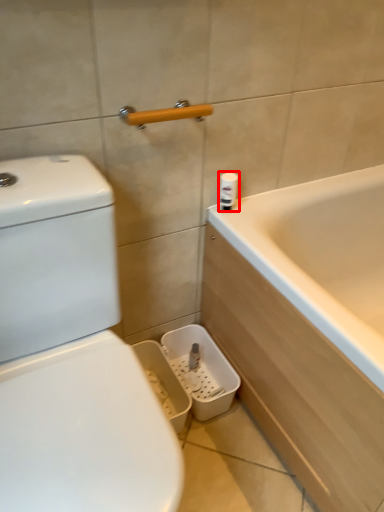
Question: In this image, where is toiletry (annotated by the red box) located relative to towel bar?

Choices:
 (A) left
 (B) right

Answer: (B)